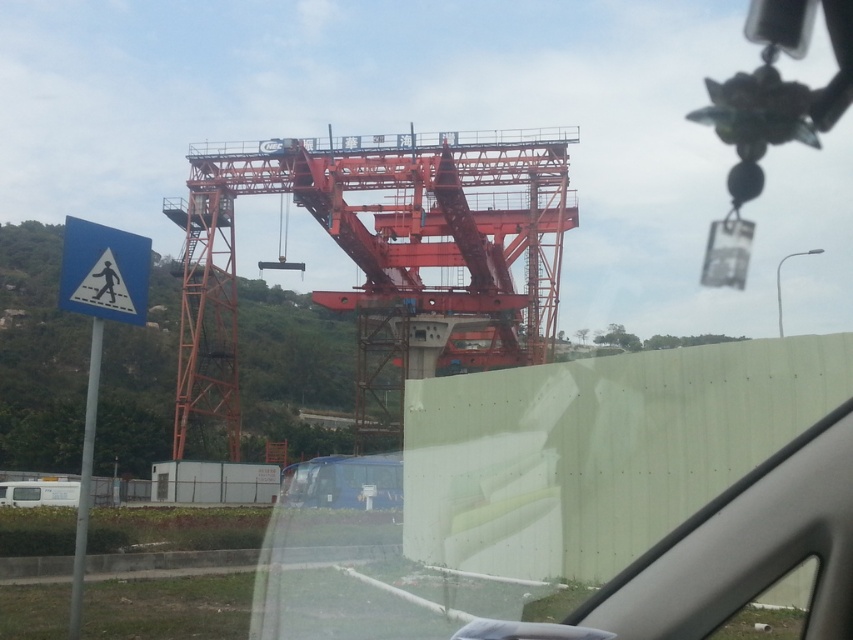
Is point (62, 262) farther from viewer compared to point (282, 499)?

No, it is not.

Between point (120, 308) and point (368, 500), which one is positioned in front?

Positioned in front is point (120, 308).

Is point (62, 252) less distant than point (358, 500)?

Yes, it is.

Find the location of `blue plastic pedestrian crossing sign at left`. blue plastic pedestrian crossing sign at left is located at coordinates (103, 272).

Does transparent glass windshield at upper center have a lesser height compared to blue plastic pedestrian crossing sign at left?

Incorrect, transparent glass windshield at upper center's height does not fall short of blue plastic pedestrian crossing sign at left's.

What do you see at coordinates (595, 502) in the screenshot? I see `transparent glass windshield at upper center` at bounding box center [595, 502].

Find the location of a particular element. transparent glass windshield at upper center is located at coordinates (595, 502).

Can you confirm if transparent glass windshield at upper center is thinner than orange metallic crane at center?

In fact, transparent glass windshield at upper center might be wider than orange metallic crane at center.

Which is below, transparent glass windshield at upper center or orange metallic crane at center?

orange metallic crane at center is lower down.

The image size is (853, 640). What do you see at coordinates (595, 502) in the screenshot?
I see `transparent glass windshield at upper center` at bounding box center [595, 502].

Where is `transparent glass windshield at upper center`? The width and height of the screenshot is (853, 640). transparent glass windshield at upper center is located at coordinates (595, 502).